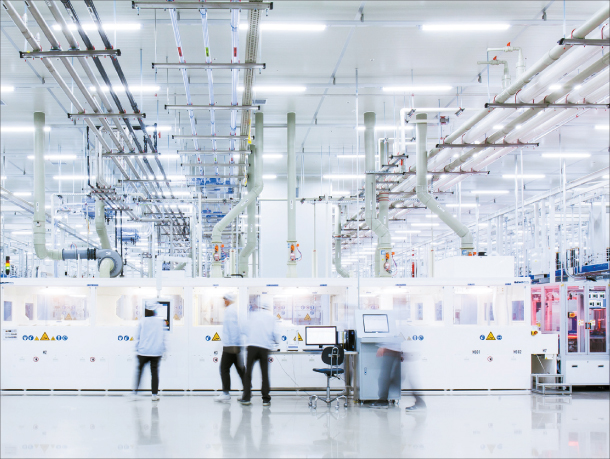
At what (x,y) coordinates should I click in order to perform the action: click on computer screens. Please return your answer as a coordinate pair (x, y). This screenshot has height=459, width=610. Looking at the image, I should click on (324, 342), (371, 324).